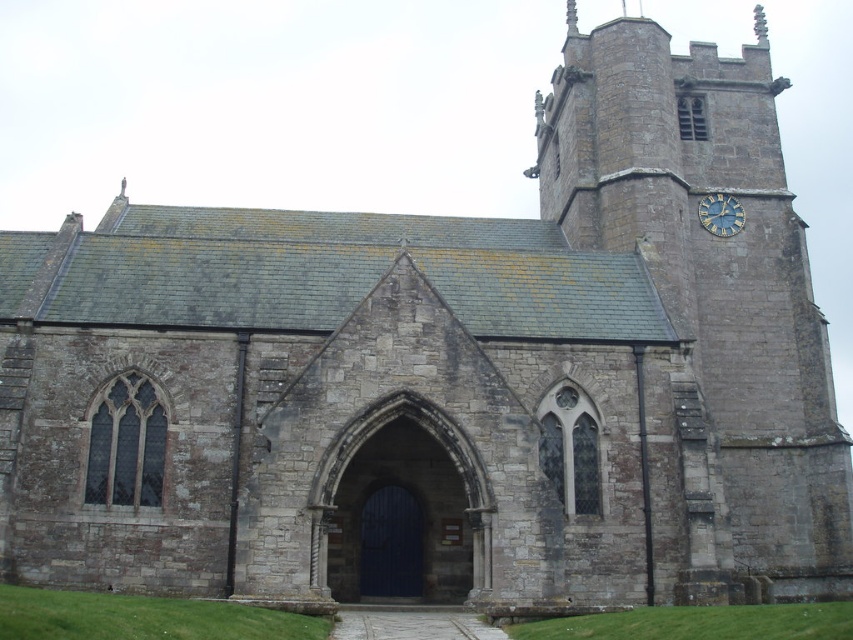
From the picture: Measure the distance between point (746, 296) and camera.

The distance of point (746, 296) from camera is 76.82 meters.

Which of these two, stone clock tower at right or gold metallic clock at upper right, stands taller?

With more height is stone clock tower at right.

This screenshot has height=640, width=853. What do you see at coordinates (708, 305) in the screenshot? I see `stone clock tower at right` at bounding box center [708, 305].

In order to click on stone clock tower at right in this screenshot , I will do 708,305.